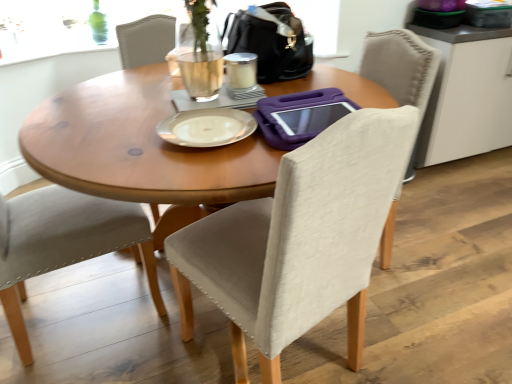
Where is `vacant area situated below light beige fabric chair at left, which appears as the 2th chair when viewed from the right (from a real-world perspective)`? The image size is (512, 384). vacant area situated below light beige fabric chair at left, which appears as the 2th chair when viewed from the right (from a real-world perspective) is located at coordinates (85, 305).